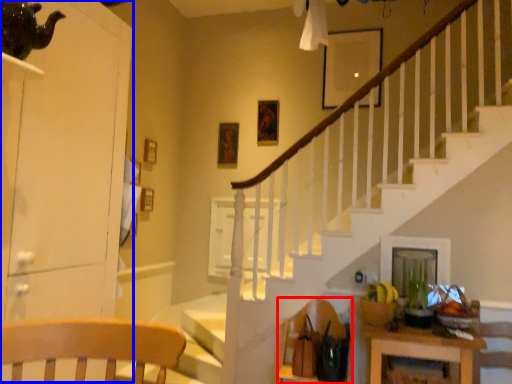
Question: Which object appears farthest to the camera in this image, armchair (highlighted by a red box) or dresser (highlighted by a blue box)?

Choices:
 (A) armchair
 (B) dresser

Answer: (A)